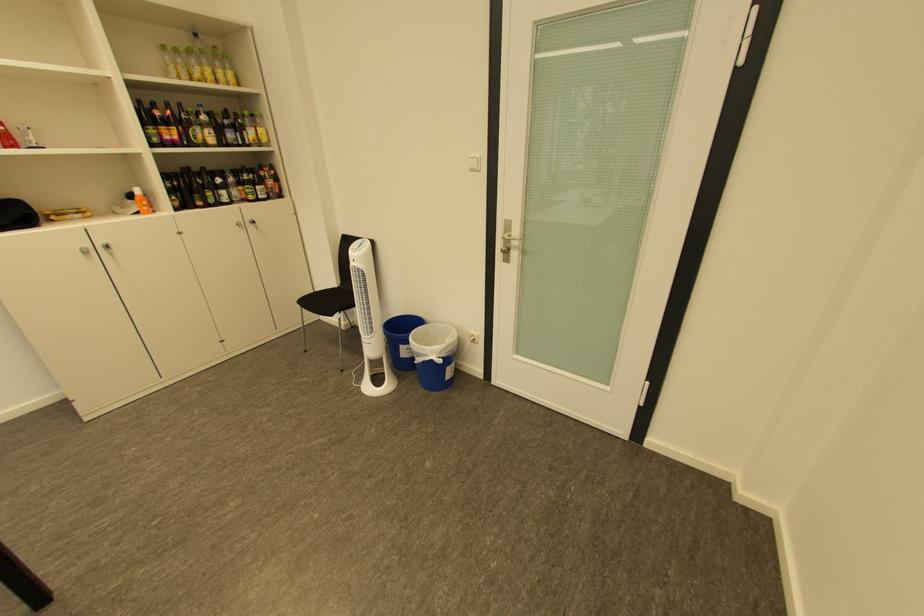
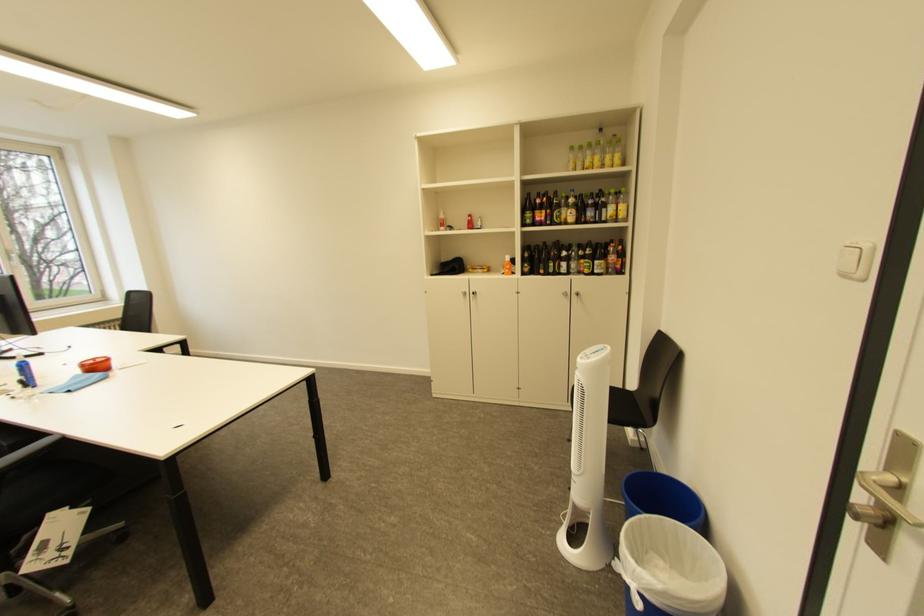
In the second image, find the point that corresponds to the point at 481,171 in the first image.

(855, 277)